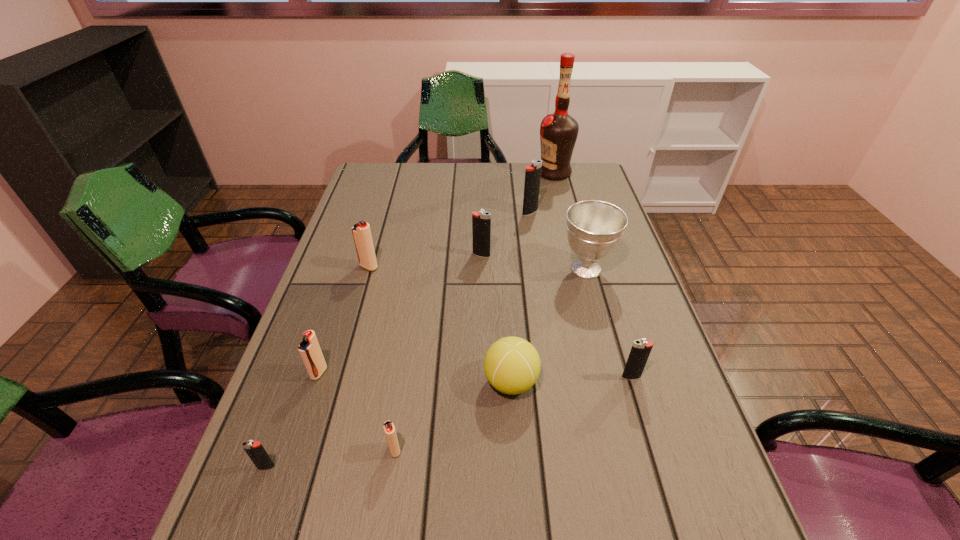
I want to click on the tallest object, so click(558, 132).

The width and height of the screenshot is (960, 540). Identify the location of liquor. (558, 132).

Where is `the farthest igniter`? the farthest igniter is located at coordinates (532, 173).

Image resolution: width=960 pixels, height=540 pixels. Identify the location of the farthest black igniter. (532, 173).

Find the location of a particular element. The width and height of the screenshot is (960, 540). chalice is located at coordinates (594, 228).

At what (x,y) coordinates should I click in order to perform the action: click on the third igniter from left to right. Please return your answer as a coordinate pair (x, y). Image resolution: width=960 pixels, height=540 pixels. Looking at the image, I should click on (361, 231).

Image resolution: width=960 pixels, height=540 pixels. In order to click on the biggest red igniter in this screenshot , I will do `click(361, 231)`.

Identify the location of the third smallest black igniter. (481, 221).

I want to click on the sixth nearest igniter, so click(x=481, y=221).

Locate an element on the screen. This screenshot has width=960, height=540. the second smallest black igniter is located at coordinates (640, 351).